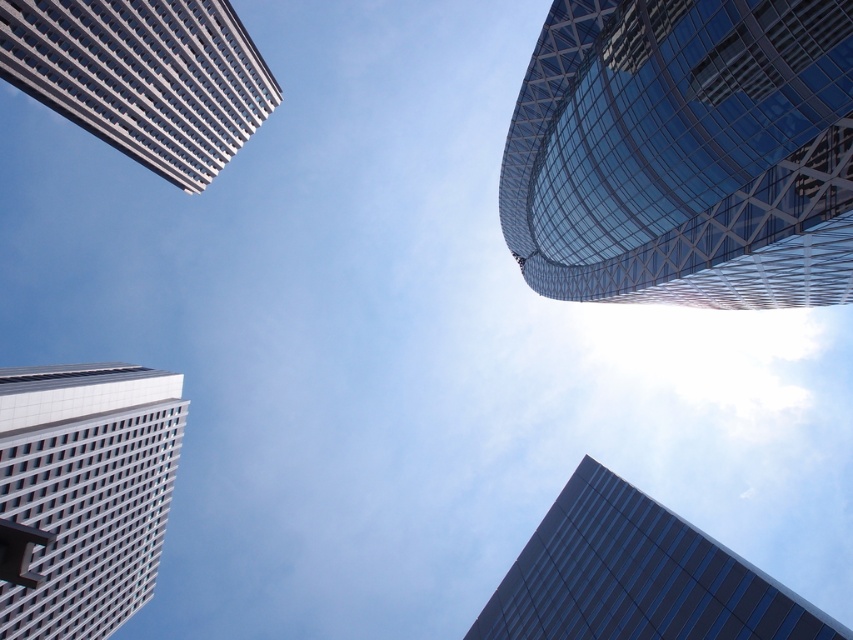
You are standing at the base of the curved skyscraper on the right side of the image. Looking towards the white grid patterned building at lower left, where is the point at coordinate (82, 493) located relative to that building?

The point at coordinate (82, 493) is located on the white grid patterned building at lower left.